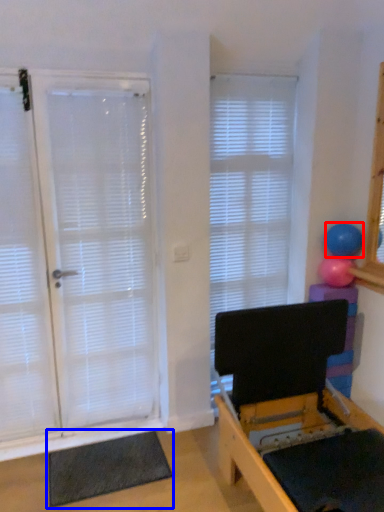
Question: Among these objects, which one is farthest to the camera, ball (highlighted by a red box) or yoga mat (highlighted by a blue box)?

Choices:
 (A) ball
 (B) yoga mat

Answer: (A)